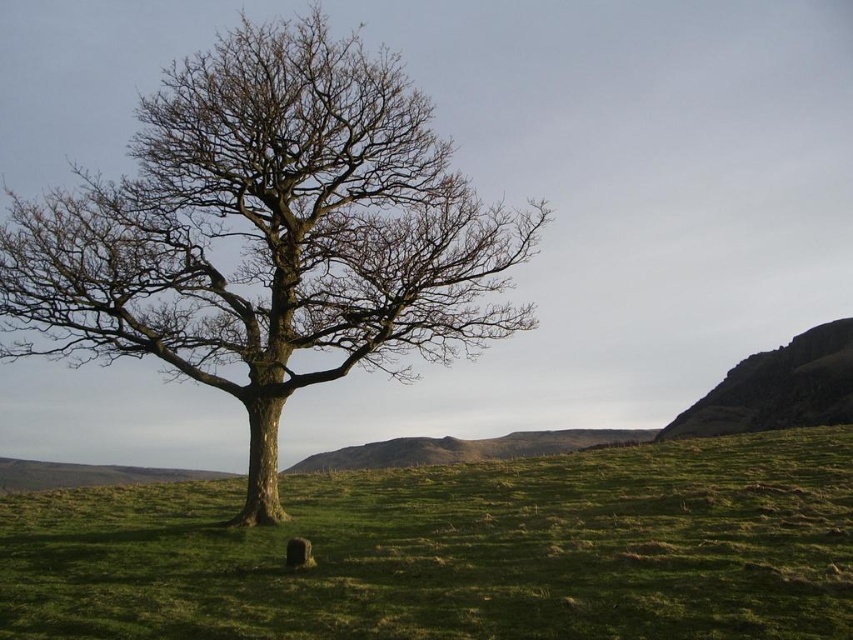
Is smooth bark tree at center smaller than rugged stone hillside at right?

Incorrect, smooth bark tree at center is not smaller in size than rugged stone hillside at right.

Does smooth bark tree at center appear under rugged stone hillside at right?

Actually, smooth bark tree at center is above rugged stone hillside at right.

Where is `smooth bark tree at center`? smooth bark tree at center is located at coordinates [268, 234].

Between green grassy field at center and smooth bark tree at center, which one appears on the right side from the viewer's perspective?

From the viewer's perspective, green grassy field at center appears more on the right side.

The image size is (853, 640). What are the coordinates of `green grassy field at center` in the screenshot? It's located at (457, 550).

Who is more forward, (x=262, y=536) or (x=90, y=305)?

Point (x=262, y=536) is in front.

Image resolution: width=853 pixels, height=640 pixels. I want to click on green grassy field at center, so click(457, 550).

Between green grassy field at center and rugged stone hillside at right, which one has less height?

Standing shorter between the two is green grassy field at center.

Which is in front, point (705, 592) or point (793, 394)?

Point (705, 592)

Identify the location of green grassy field at center. (457, 550).